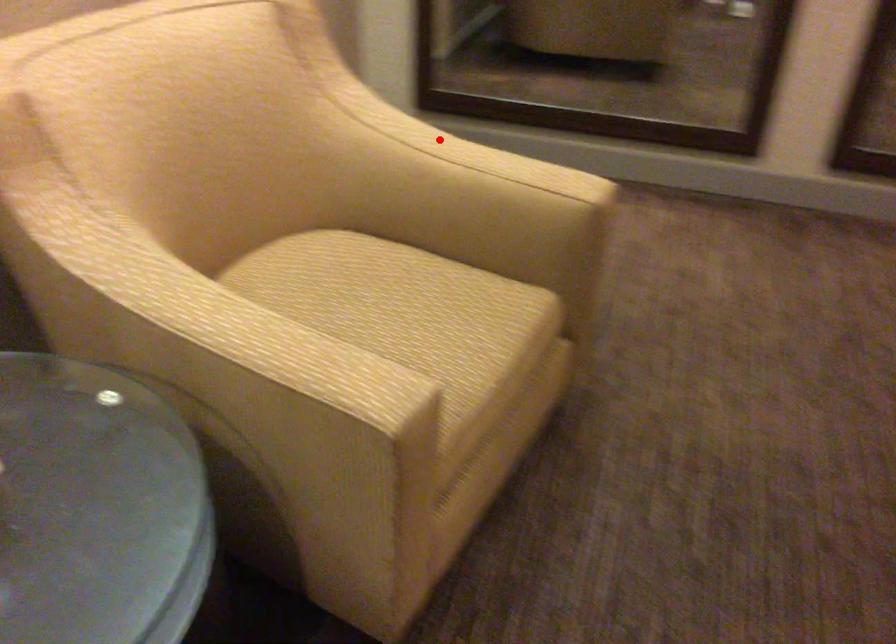
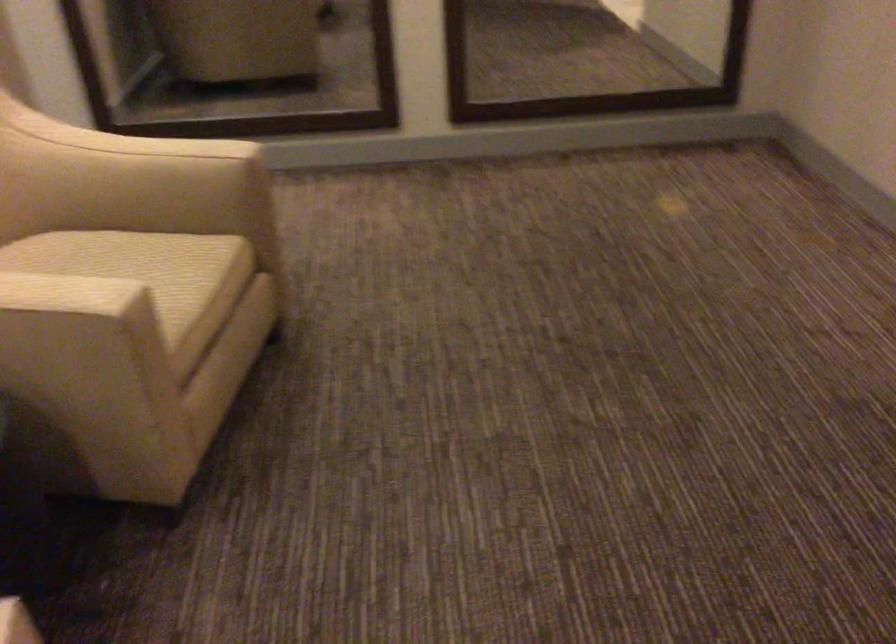
Find the pixel in the second image that matches the highlighted location in the first image.

(116, 136)